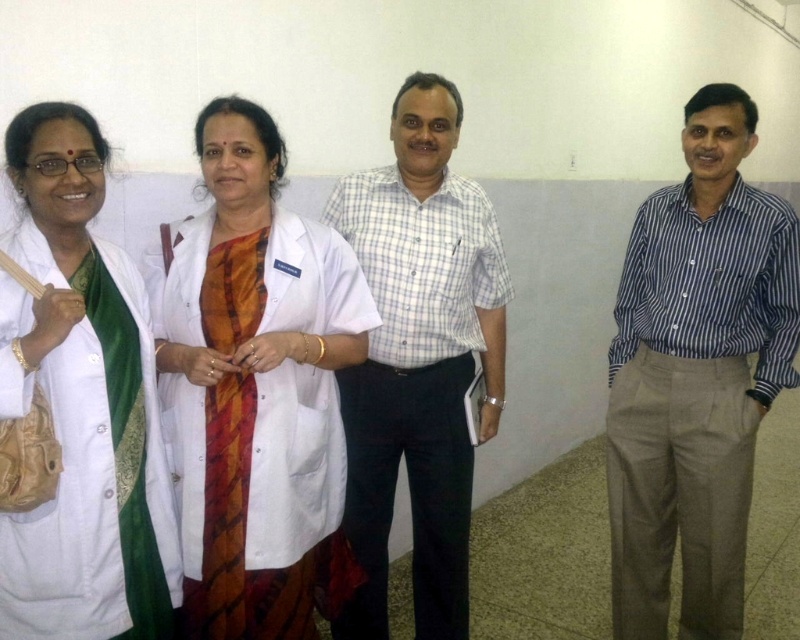
Question: Which object is farther from the camera taking this photo?

Choices:
 (A) orange striped fabric at center
 (B) white checkered shirt at center
 (C) white matte lab coat at left
 (D) blue striped shirt at center

Answer: (D)

Question: Which point is farther from the camera taking this photo?

Choices:
 (A) (121, 588)
 (B) (472, 198)

Answer: (B)

Question: Where is white matte lab coat at left located in relation to orange striped fabric at center in the image?

Choices:
 (A) right
 (B) left

Answer: (B)

Question: In this image, where is blue striped shirt at center located relative to white checkered shirt at center?

Choices:
 (A) below
 (B) above

Answer: (A)

Question: Does blue striped shirt at center appear on the left side of white matte lab coat at left?

Choices:
 (A) no
 (B) yes

Answer: (A)

Question: Which point is farther from the camera taking this photo?

Choices:
 (A) (378, 339)
 (B) (73, 557)
 (C) (748, 192)

Answer: (C)